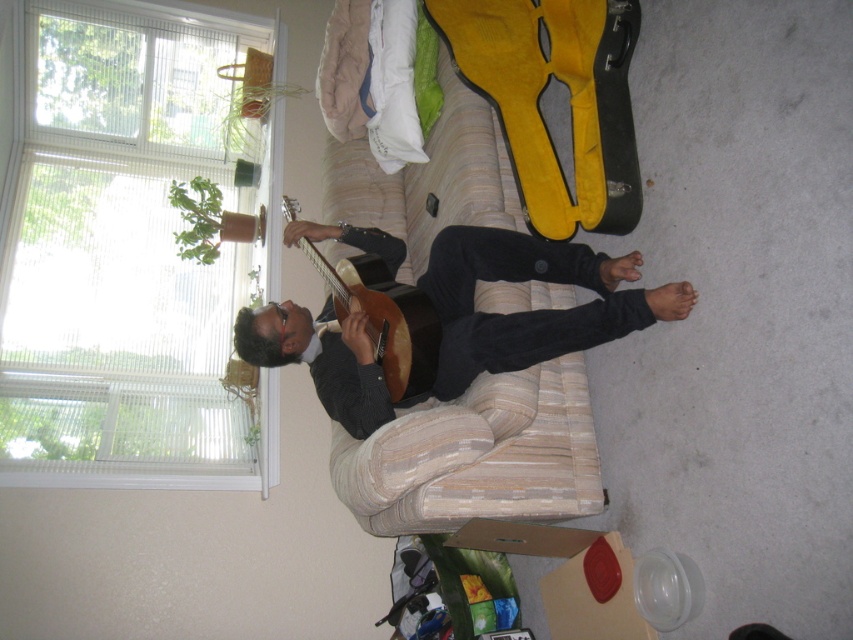
Question: Which object is closer to the camera taking this photo?

Choices:
 (A) yellow fabric bed at center
 (B) matte brown guitar at center
 (C) wooden acoustic guitar at center

Answer: (B)

Question: Which point is farther from the camera taking this photo?

Choices:
 (A) (x=415, y=378)
 (B) (x=291, y=332)
 (C) (x=427, y=243)

Answer: (C)

Question: Can you confirm if yellow fabric bed at center is positioned below wooden acoustic guitar at center?

Choices:
 (A) yes
 (B) no

Answer: (B)

Question: Considering the real-world distances, which object is closest to the yellow fabric bed at center?

Choices:
 (A) matte brown guitar at center
 (B) wooden acoustic guitar at center

Answer: (B)

Question: Can you confirm if matte brown guitar at center is positioned to the right of wooden acoustic guitar at center?

Choices:
 (A) yes
 (B) no

Answer: (A)

Question: From the image, what is the correct spatial relationship of yellow fabric bed at center in relation to wooden acoustic guitar at center?

Choices:
 (A) above
 (B) below

Answer: (A)